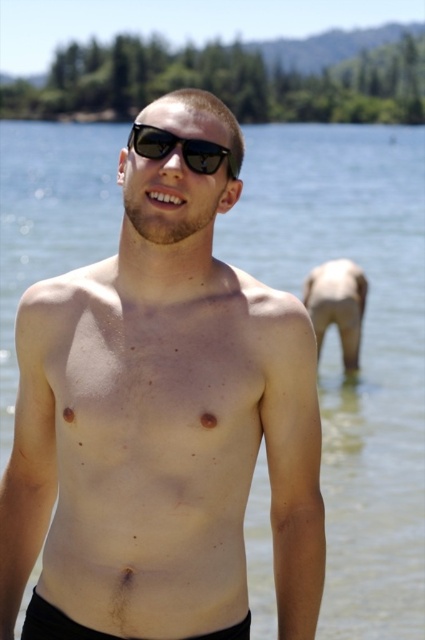
Question: Is matte skin at center to the left of black reflective sunglasses at center from the viewer's perspective?

Choices:
 (A) no
 (B) yes

Answer: (B)

Question: Which point is farther to the camera?

Choices:
 (A) black reflective sunglasses at center
 (B) matte skin at center

Answer: (B)

Question: In this image, where is matte skin at center located relative to black reflective sunglasses at center?

Choices:
 (A) left
 (B) right

Answer: (A)

Question: Which point is farther to the camera?

Choices:
 (A) matte skin at center
 (B) black reflective sunglasses at center

Answer: (A)

Question: Where is matte skin at center located in relation to black reflective sunglasses at center in the image?

Choices:
 (A) below
 (B) above

Answer: (A)